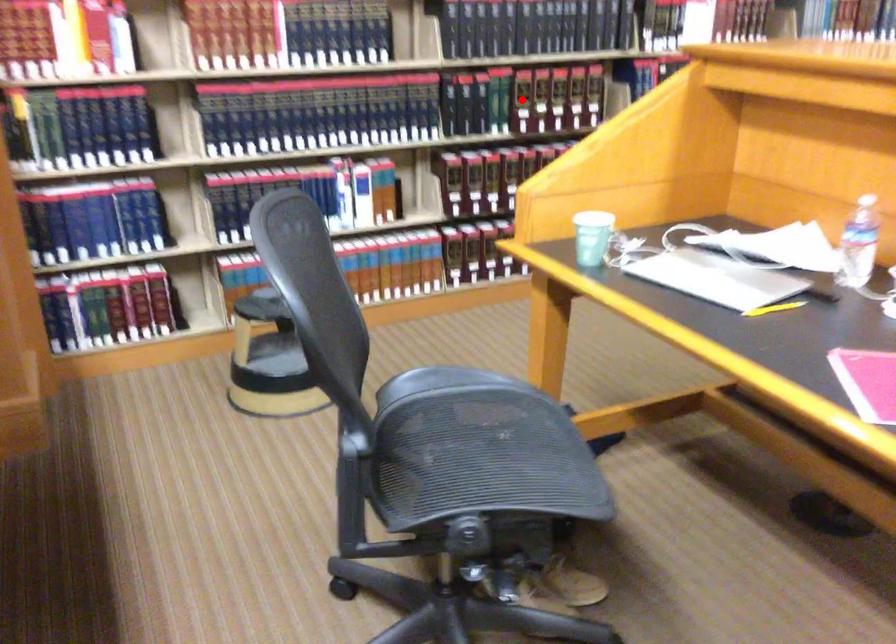
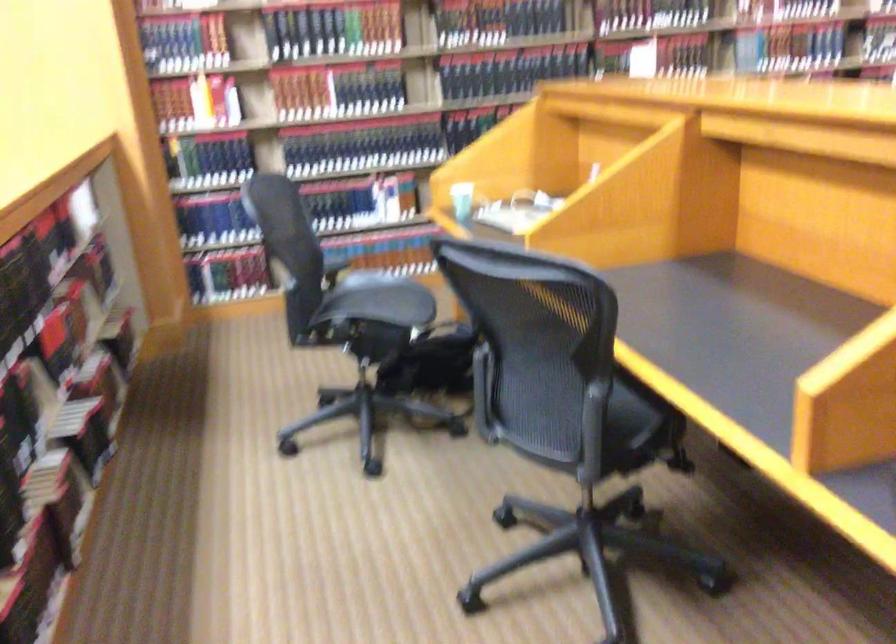
Question: I am providing you with two images of the same scene from different viewpoints. A red point is marked on the first image. Is the red point's position out of view in image 2?

Choices:
 (A) Yes
 (B) No

Answer: (A)